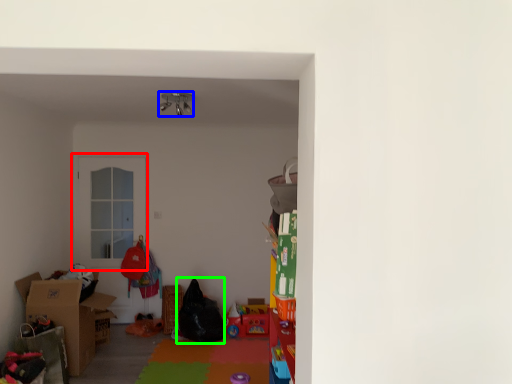
Question: Which object is the farthest from door (highlighted by a red box)? Choose among these: lamp (highlighted by a blue box) or bean bag chair (highlighted by a green box).

Choices:
 (A) lamp
 (B) bean bag chair

Answer: (A)